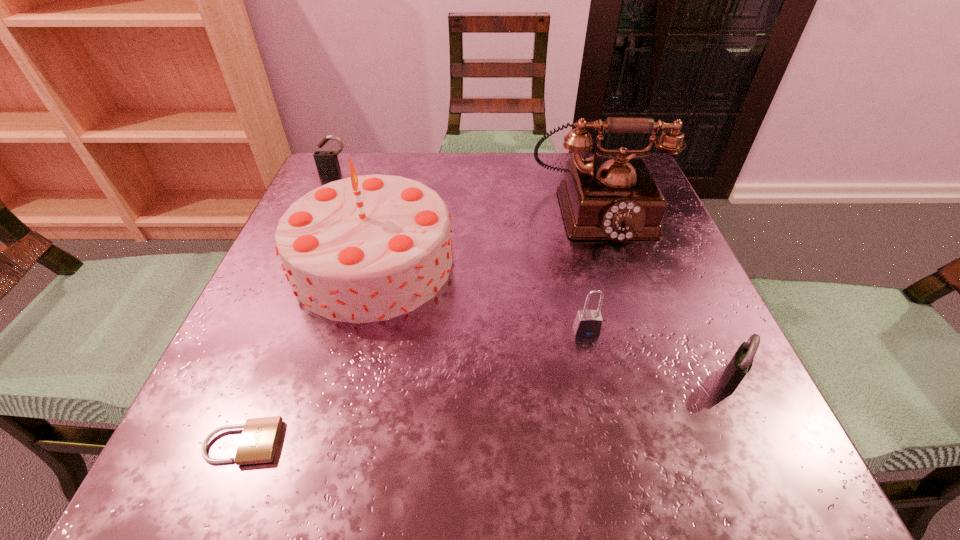
Identify the location of birthday cake. This screenshot has width=960, height=540. (368, 248).

Find the location of a particular element. telephone is located at coordinates (617, 199).

The image size is (960, 540). I want to click on the farthest object, so click(x=326, y=161).

Find the location of a particular element. the third nearest padlock is located at coordinates (588, 323).

At what (x,y) coordinates should I click in order to perform the action: click on the third farthest padlock. Please return your answer as a coordinate pair (x, y). Image resolution: width=960 pixels, height=540 pixels. Looking at the image, I should click on (739, 366).

Identify the location of the second nearest object. The height and width of the screenshot is (540, 960). (739, 366).

This screenshot has height=540, width=960. Find the location of `the nearest object`. the nearest object is located at coordinates (259, 439).

Image resolution: width=960 pixels, height=540 pixels. In order to click on the nearest padlock in this screenshot , I will do `click(259, 439)`.

In order to click on vacant region located 0.210m on the right of the birthday cake in this screenshot , I will do `click(570, 263)`.

The height and width of the screenshot is (540, 960). In order to click on vacant space located 0.090m on the dial of the telephone in this screenshot , I will do `click(618, 280)`.